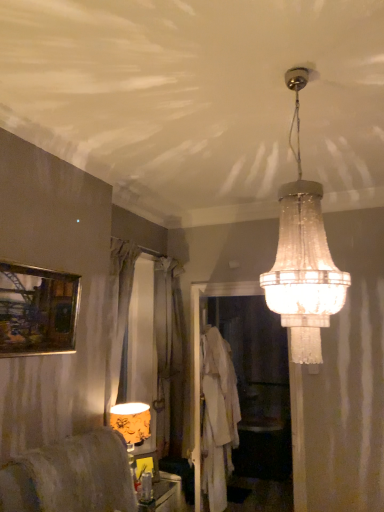
Describe the element at coordinates (218, 417) in the screenshot. I see `white fabric robe at center` at that location.

Measure the distance between point (68, 456) and camera.

The depth of point (68, 456) is 2.22 meters.

Describe the element at coordinates (37, 310) in the screenshot. This screenshot has height=512, width=384. I see `gold-framed painting at upper left` at that location.

Locate an element on the screen. The image size is (384, 512). silky gray curtain at center is located at coordinates (170, 357).

What do you see at coordinates (132, 426) in the screenshot?
I see `yellow floral fabric lampshade at lower left, which appears as the second lamp when viewed from the top` at bounding box center [132, 426].

Measure the distance between point (157,505) and camera.

They are 9.83 feet apart.

The width and height of the screenshot is (384, 512). What are the coordinates of `clear glass chandelier at upper center, which is counted as the second lamp, starting from the bottom` in the screenshot? It's located at (303, 256).

From a real-world perspective, is clear glass chandelier at upper center, the 1th lamp when ordered from front to back, physically below translucent glass bottle at lower center, acting as the 2th furniture starting from the top?

No.

Who is bigger, clear glass chandelier at upper center, marked as the second lamp in a left-to-right arrangement, or translucent glass bottle at lower center, arranged as the second furniture when viewed from the front?

With larger size is clear glass chandelier at upper center, marked as the second lamp in a left-to-right arrangement.

Which of these two, clear glass chandelier at upper center, which is counted as the second lamp, starting from the bottom, or translucent glass bottle at lower center, which is counted as the first furniture, starting from the back, stands shorter?

translucent glass bottle at lower center, which is counted as the first furniture, starting from the back.

Could you tell me if clear glass chandelier at upper center, the 1th lamp in the right-to-left sequence, is turned towards translucent glass bottle at lower center, the 1th furniture positioned from the bottom?

No, clear glass chandelier at upper center, the 1th lamp in the right-to-left sequence, is not turned towards translucent glass bottle at lower center, the 1th furniture positioned from the bottom.

Is silky gray curtain at center further to camera compared to gold-framed painting at upper left?

Yes, the depth of silky gray curtain at center is greater than that of gold-framed painting at upper left.

You are a GUI agent. You are given a task and a screenshot of the screen. Output one action in this format:
    pyautogui.click(x=<x>, y=<y>)
    Task: Click on the curtain behind the gold-framed painting at upper left
    Image resolution: width=384 pixels, height=512 pixels.
    Given the screenshot: What is the action you would take?
    pyautogui.click(x=170, y=357)

Is silky gray curtain at center thinner than gold-framed painting at upper left?

No.

How many degrees apart are the facing directions of silky gray curtain at center and gold-framed painting at upper left?

They differ by 0.0873 degrees in their facing directions.

Considering the relative sizes of matte gray fabric chair at lower left, which is counted as the first furniture, starting from the front, and yellow floral fabric lampshade at lower left, the 1th lamp viewed from the back, in the image provided, is matte gray fabric chair at lower left, which is counted as the first furniture, starting from the front, smaller than yellow floral fabric lampshade at lower left, the 1th lamp viewed from the back,?

Actually, matte gray fabric chair at lower left, which is counted as the first furniture, starting from the front, might be larger than yellow floral fabric lampshade at lower left, the 1th lamp viewed from the back.

Looking at this image, does matte gray fabric chair at lower left, arranged as the second furniture when ordered from the bottom, turn towards yellow floral fabric lampshade at lower left, the 1th lamp viewed from the back?

No.

From a real-world perspective, between matte gray fabric chair at lower left, the 1th furniture viewed from the top, and yellow floral fabric lampshade at lower left, which ranks as the second lamp in front-to-back order, who is vertically higher?

yellow floral fabric lampshade at lower left, which ranks as the second lamp in front-to-back order.

Which object is positioned more to the right, matte gray fabric chair at lower left, arranged as the second furniture when ordered from the bottom, or yellow floral fabric lampshade at lower left, the 1th lamp viewed from the back?

Positioned to the right is yellow floral fabric lampshade at lower left, the 1th lamp viewed from the back.

Is gold-framed painting at upper left inside matte gray fabric chair at lower left, the 1th furniture viewed from the top?

No, matte gray fabric chair at lower left, the 1th furniture viewed from the top, does not contain gold-framed painting at upper left.

Which object is thinner, matte gray fabric chair at lower left, the second furniture viewed from the back, or gold-framed painting at upper left?

gold-framed painting at upper left.

Which is closer to the camera, (60, 487) or (66, 343)?

Point (60, 487) is positioned closer to the camera compared to point (66, 343).

From a real-world perspective, which is physically below, matte gray fabric chair at lower left, the second furniture viewed from the back, or gold-framed painting at upper left?

matte gray fabric chair at lower left, the second furniture viewed from the back, from a real-world perspective.

Is the position of clear glass chandelier at upper center, which is counted as the second lamp, starting from the bottom, less distant than that of yellow floral fabric lampshade at lower left, which appears as the second lamp when viewed from the top?

Yes, it is in front of yellow floral fabric lampshade at lower left, which appears as the second lamp when viewed from the top.

Is clear glass chandelier at upper center, the 1th lamp in the right-to-left sequence, to the left of yellow floral fabric lampshade at lower left, the 2th lamp viewed from the right, from the viewer's perspective?

No.

Which point is more distant from viewer, (308, 182) or (146, 413)?

The point (146, 413) is farther.

Is clear glass chandelier at upper center, which is counted as the second lamp, starting from the bottom, next to yellow floral fabric lampshade at lower left, the 1th lamp viewed from the back, and touching it?

No.

In terms of height, does translucent glass bottle at lower center, acting as the 2th furniture starting from the top, look taller or shorter compared to matte gray fabric chair at lower left, which is counted as the first furniture, starting from the front?

In the image, translucent glass bottle at lower center, acting as the 2th furniture starting from the top, appears to be shorter than matte gray fabric chair at lower left, which is counted as the first furniture, starting from the front.

Image resolution: width=384 pixels, height=512 pixels. In order to click on furniture above the translucent glass bottle at lower center, acting as the 2th furniture starting from the top (from the image's perspective) in this screenshot , I will do `click(71, 476)`.

In the scene shown: Is translucent glass bottle at lower center, arranged as the second furniture when viewed from the front, next to matte gray fabric chair at lower left, which is counted as the first furniture, starting from the front, and touching it?

No, translucent glass bottle at lower center, arranged as the second furniture when viewed from the front, is not in contact with matte gray fabric chair at lower left, which is counted as the first furniture, starting from the front.

Does translucent glass bottle at lower center, the 1th furniture positioned from the bottom, appear on the left side of clear glass chandelier at upper center, the 1th lamp in the right-to-left sequence?

Correct, you'll find translucent glass bottle at lower center, the 1th furniture positioned from the bottom, to the left of clear glass chandelier at upper center, the 1th lamp in the right-to-left sequence.

From the image's perspective, which is below, translucent glass bottle at lower center, which is counted as the first furniture, starting from the back, or clear glass chandelier at upper center, which is counted as the second lamp, starting from the bottom?

translucent glass bottle at lower center, which is counted as the first furniture, starting from the back, from the image's perspective.

Which of these two, translucent glass bottle at lower center, which is counted as the first furniture, starting from the back, or clear glass chandelier at upper center, which is counted as the second lamp, starting from the bottom, is wider?

Wider between the two is clear glass chandelier at upper center, which is counted as the second lamp, starting from the bottom.

Considering the relative sizes of translucent glass bottle at lower center, acting as the 2th furniture starting from the top, and clear glass chandelier at upper center, which appears as the 2th lamp when viewed from the back, in the image provided, is translucent glass bottle at lower center, acting as the 2th furniture starting from the top, shorter than clear glass chandelier at upper center, which appears as the 2th lamp when viewed from the back,?

Indeed, translucent glass bottle at lower center, acting as the 2th furniture starting from the top, has a lesser height compared to clear glass chandelier at upper center, which appears as the 2th lamp when viewed from the back.

Identify the location of lamp on the right of translucent glass bottle at lower center, arranged as the second furniture when viewed from the front. The height and width of the screenshot is (512, 384). (303, 256).

I want to click on curtain below the gold-framed painting at upper left (from the image's perspective), so click(170, 357).

Which object lies further to the anchor point yellow floral fabric lampshade at lower left, which ranks as the second lamp in front-to-back order, white fabric robe at center or clear glass chandelier at upper center, the 1th lamp when ordered from front to back?

Based on the image, clear glass chandelier at upper center, the 1th lamp when ordered from front to back, appears to be further to yellow floral fabric lampshade at lower left, which ranks as the second lamp in front-to-back order.

When comparing their distances from silky gray curtain at center, does gold-framed painting at upper left or yellow floral fabric lampshade at lower left, the 1th lamp when ordered from bottom to top, seem closer?

yellow floral fabric lampshade at lower left, the 1th lamp when ordered from bottom to top, lies closer to silky gray curtain at center than the other object.

From the picture: Estimate the real-world distances between objects in this image. Which object is further from gold-framed painting at upper left, translucent glass bottle at lower center, the 1th furniture positioned from the bottom, or clear glass chandelier at upper center, which is counted as the second lamp, starting from the bottom?

translucent glass bottle at lower center, the 1th furniture positioned from the bottom, lies further to gold-framed painting at upper left than the other object.

Looking at the image, which one is located closer to clear glass chandelier at upper center, the 1th lamp in the right-to-left sequence, matte gray fabric chair at lower left, the 1th furniture viewed from the top, or yellow floral fabric lampshade at lower left, which ranks as the second lamp in front-to-back order?

matte gray fabric chair at lower left, the 1th furniture viewed from the top.

Which object lies further to the anchor point white fabric robe at center, silky gray curtain at center or translucent glass bottle at lower center, the 1th furniture positioned from the bottom?

Based on the image, silky gray curtain at center appears to be further to white fabric robe at center.

Considering their positions, is gold-framed painting at upper left positioned further to white fabric robe at center than yellow floral fabric lampshade at lower left, placed as the 1th lamp when sorted from left to right?

gold-framed painting at upper left is positioned further to the anchor white fabric robe at center.

Looking at the image, which one is located further to clear glass chandelier at upper center, the first lamp positioned from the top, translucent glass bottle at lower center, arranged as the second furniture when viewed from the front, or gold-framed painting at upper left?

Based on the image, translucent glass bottle at lower center, arranged as the second furniture when viewed from the front, appears to be further to clear glass chandelier at upper center, the first lamp positioned from the top.

Considering their positions, is matte gray fabric chair at lower left, the 1th furniture viewed from the top, positioned further to clear glass chandelier at upper center, which is counted as the second lamp, starting from the bottom, than gold-framed painting at upper left?

matte gray fabric chair at lower left, the 1th furniture viewed from the top, is further to clear glass chandelier at upper center, which is counted as the second lamp, starting from the bottom.

Identify the location of robe located between translucent glass bottle at lower center, arranged as the second furniture when viewed from the front, and silky gray curtain at center in the depth direction. (218, 417).

What are the coordinates of `furniture positioned between matte gray fabric chair at lower left, arranged as the second furniture when ordered from the bottom, and silky gray curtain at center from near to far` in the screenshot? It's located at (164, 496).

You are a GUI agent. You are given a task and a screenshot of the screen. Output one action in this format:
    pyautogui.click(x=<x>, y=<y>)
    Task: Click on the picture frame located between matte gray fabric chair at lower left, the second furniture viewed from the back, and white fabric robe at center in the depth direction
    This screenshot has width=384, height=512.
    Given the screenshot: What is the action you would take?
    pyautogui.click(x=37, y=310)

Locate an element on the screen. The image size is (384, 512). lamp between clear glass chandelier at upper center, the first lamp positioned from the top, and white fabric robe at center, along the z-axis is located at coordinates (132, 426).